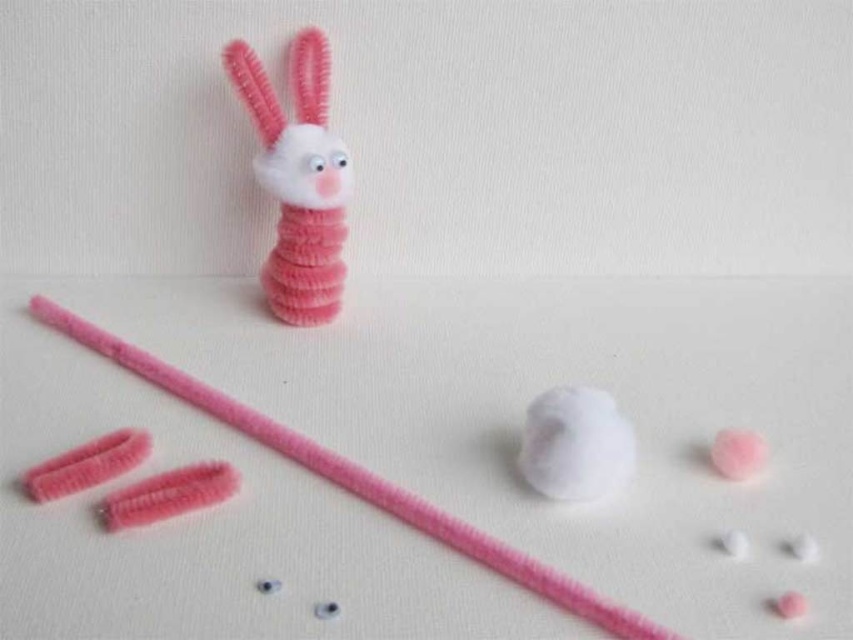
Question: Does fuzzy pink pipe cleaner at center come behind white fluffy ball at center?

Choices:
 (A) no
 (B) yes

Answer: (A)

Question: Which object appears closest to the camera in this image?

Choices:
 (A) matte pink pipe cleaner at center
 (B) white fluffy ball at center
 (C) fuzzy pink pipe cleaner at center

Answer: (C)

Question: Which point is closer to the camera?

Choices:
 (A) (579, 451)
 (B) (468, 545)

Answer: (B)

Question: Is matte pink pipe cleaner at center bigger than white fluffy ball at center?

Choices:
 (A) no
 (B) yes

Answer: (B)

Question: Does matte pink pipe cleaner at center have a larger size compared to white fluffy ball at center?

Choices:
 (A) yes
 (B) no

Answer: (A)

Question: Which object is positioned farthest from the fuzzy pink pipe cleaner at center?

Choices:
 (A) white fluffy ball at center
 (B) matte pink pipe cleaner at center

Answer: (B)